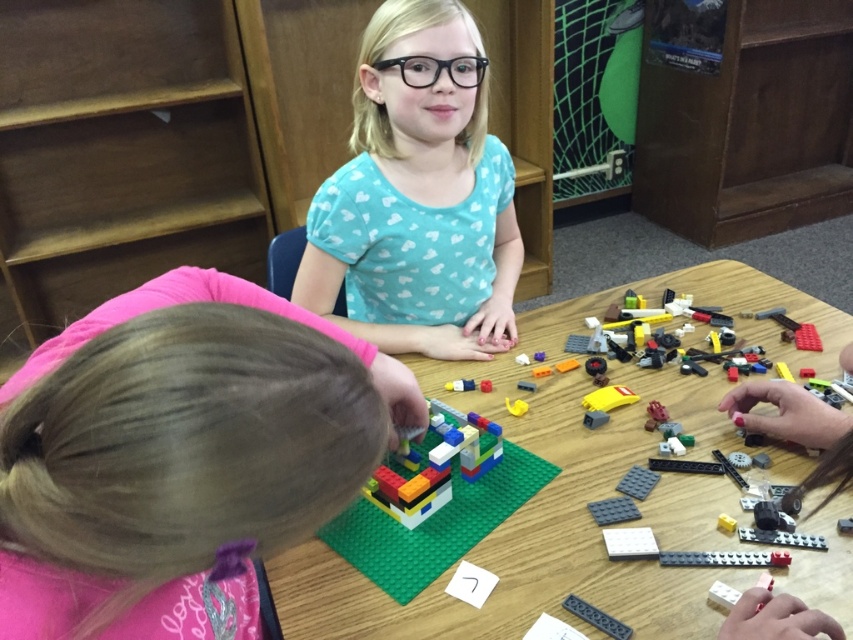
Between multicolored plastic lego pieces at center and blue matte shirt at upper center, which one is positioned higher?

blue matte shirt at upper center is higher up.

Who is positioned more to the left, multicolored plastic lego pieces at center or blue matte shirt at upper center?

From the viewer's perspective, blue matte shirt at upper center appears more on the left side.

Which is in front, point (341, 632) or point (469, 104)?

Point (341, 632) is in front.

Locate an element on the screen. multicolored plastic lego pieces at center is located at coordinates (535, 512).

Which is above, translucent plastic lego at center or yellow plastic toy at center?

yellow plastic toy at center is above.

Between point (444, 429) and point (630, 394), which one is positioned behind?

Positioned behind is point (630, 394).

From the picture: Who is more forward, (469,452) or (585,401)?

Point (469,452) is in front.

Where is `translucent plastic lego at center`? The height and width of the screenshot is (640, 853). translucent plastic lego at center is located at coordinates (436, 467).

Can you confirm if yellow plastic toy at center is positioned below smooth plastic lego piece at center?

Yes.

Does yellow plastic toy at center have a lesser height compared to smooth plastic lego piece at center?

Incorrect, yellow plastic toy at center's height does not fall short of smooth plastic lego piece at center's.

The image size is (853, 640). Describe the element at coordinates (608, 397) in the screenshot. I see `yellow plastic toy at center` at that location.

At what (x,y) coordinates should I click in order to perform the action: click on yellow plastic toy at center. Please return your answer as a coordinate pair (x, y). Image resolution: width=853 pixels, height=640 pixels. Looking at the image, I should click on (608, 397).